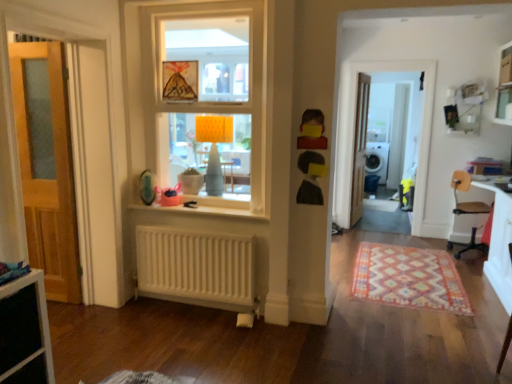
The width and height of the screenshot is (512, 384). In order to click on space that is in front of white matte radiator at lower center in this screenshot , I will do tap(198, 338).